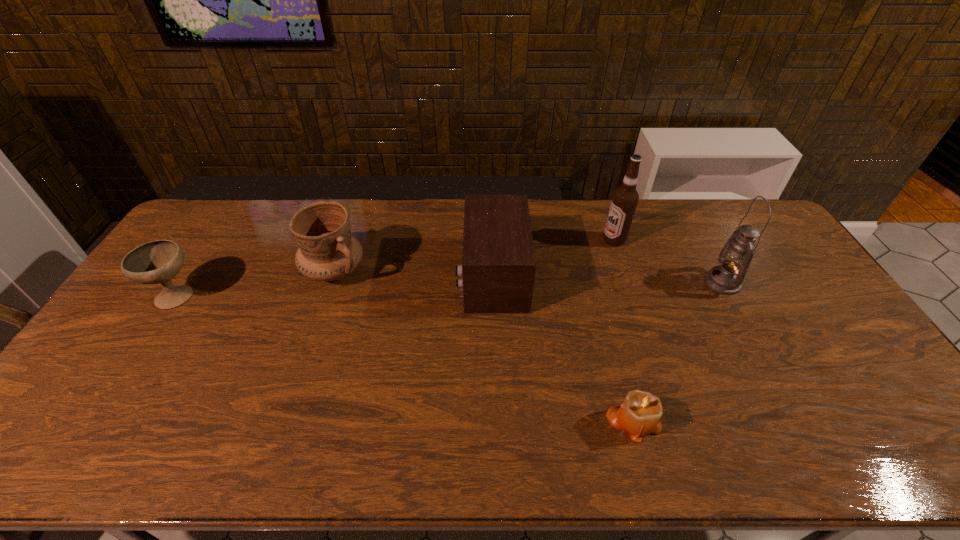
You are a GUI agent. You are given a task and a screenshot of the screen. Output one action in this format:
    pyautogui.click(x=<x>, y=<y>)
    Task: Click on the alcohol
    This screenshot has height=540, width=960.
    Given the screenshot: What is the action you would take?
    pyautogui.click(x=625, y=198)

The image size is (960, 540). Identify the location of the rightmost object. (735, 257).

Locate an element on the screen. Image resolution: width=960 pixels, height=540 pixels. the fifth object from right to left is located at coordinates (327, 251).

Locate an element on the screen. the fourth object from right to left is located at coordinates (498, 267).

Where is `chalice`? The image size is (960, 540). chalice is located at coordinates (155, 262).

Find the location of a particular element. the leftmost object is located at coordinates (155, 262).

Locate an element on the screen. the nearest object is located at coordinates [640, 414].

At what (x,y) coordinates should I click in order to perform the action: click on the shortest object. Please return your answer as a coordinate pair (x, y). Looking at the image, I should click on (640, 414).

Locate an element on the screen. vacant region located on the label of the alcohol is located at coordinates (554, 240).

Find the location of `vacant region located 0.270m on the label of the alcohol`. vacant region located 0.270m on the label of the alcohol is located at coordinates (525, 240).